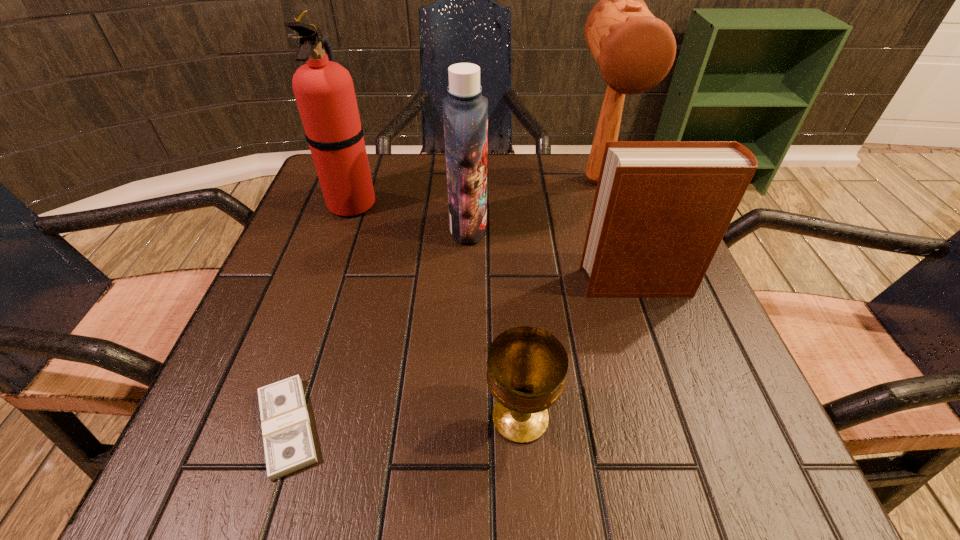
Identify the location of vacant space situated 0.380m on the open cover of the third shortest object. (368, 283).

Image resolution: width=960 pixels, height=540 pixels. Identify the location of blank space located on the open cover of the third shortest object. (542, 283).

Identify the location of vacant region located 0.240m on the open cover of the third shortest object. This screenshot has width=960, height=540. (446, 283).

This screenshot has height=540, width=960. I want to click on blank space located 0.270m on the right of the second shortest object, so click(x=753, y=417).

Locate an element on the screen. This screenshot has height=540, width=960. vacant space located 0.360m on the right of the shortest object is located at coordinates (595, 427).

Where is `fire extinguisher present at the far edge`? The image size is (960, 540). fire extinguisher present at the far edge is located at coordinates (324, 91).

You are a GUI agent. You are given a task and a screenshot of the screen. Output one action in this format:
    pyautogui.click(x=<x>, y=<y>)
    Task: Click on the mallet located in the far edge section of the desktop
    This screenshot has height=540, width=960.
    Given the screenshot: What is the action you would take?
    pyautogui.click(x=634, y=51)

The height and width of the screenshot is (540, 960). I want to click on shampoo present at the far edge, so (465, 111).

You are a GUI agent. You are given a task and a screenshot of the screen. Output one action in this format:
    pyautogui.click(x=<x>, y=<y>)
    Task: Click on the chalice that is positioned at the near edge
    
    Given the screenshot: What is the action you would take?
    527,367

You are a GUI agent. You are given a task and a screenshot of the screen. Output one action in this format:
    pyautogui.click(x=<x>, y=<y>)
    Task: Click on the dollar located at the near edge
    The width and height of the screenshot is (960, 540).
    Given the screenshot: What is the action you would take?
    pyautogui.click(x=288, y=443)